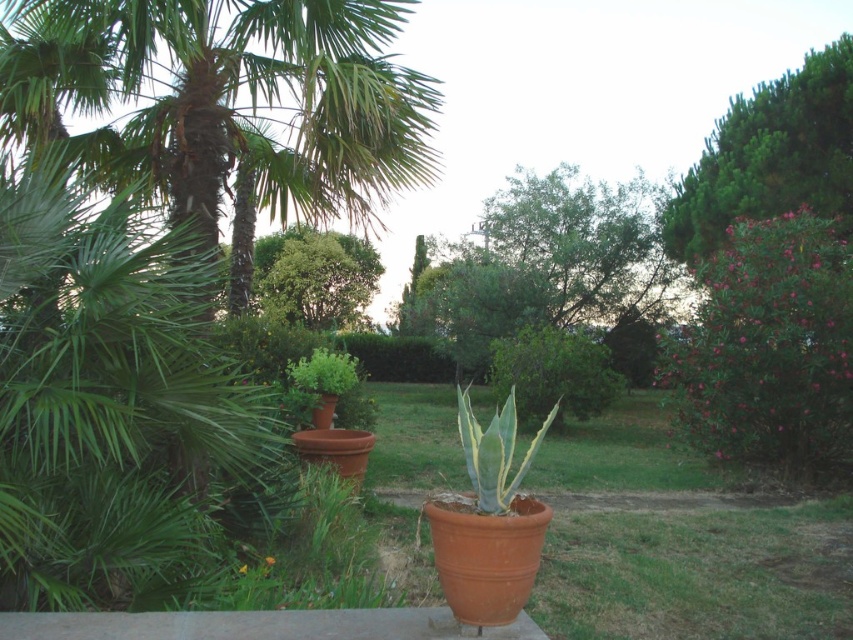
You are a gardener who wants to prune the plants in the garden. Which of the two plants, the green leafy palm at upper left or the green leafy tree at upper right, requires more attention because it has a thicker trunk?

The green leafy tree at upper right requires more attention because it has a thicker trunk than the green leafy palm at upper left.